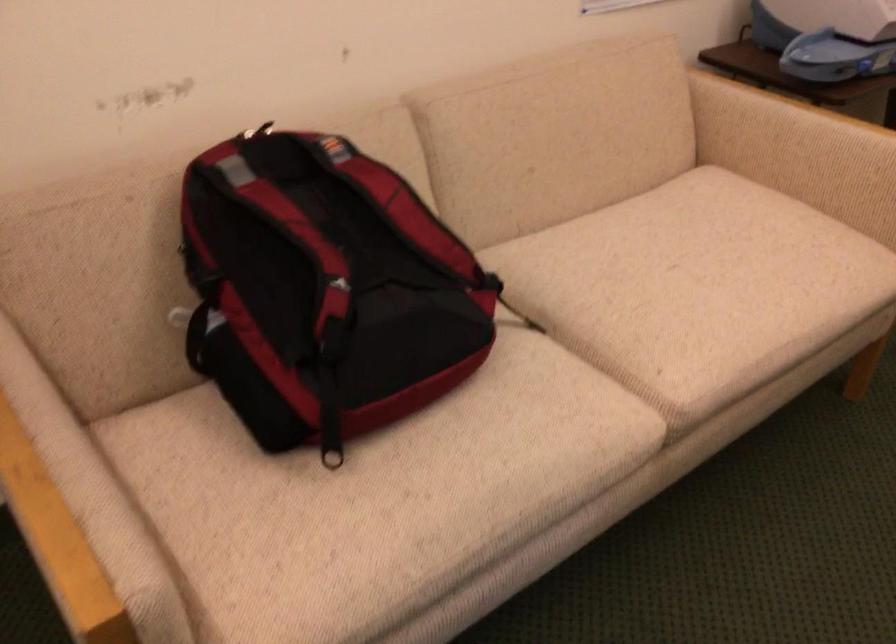
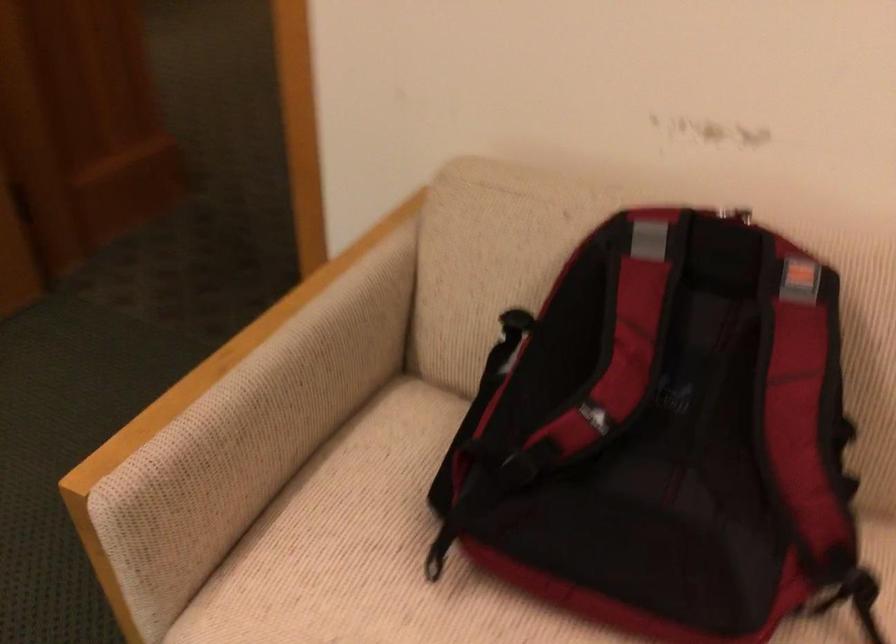
How did the camera likely rotate?

The rotation direction of the camera is left-down.